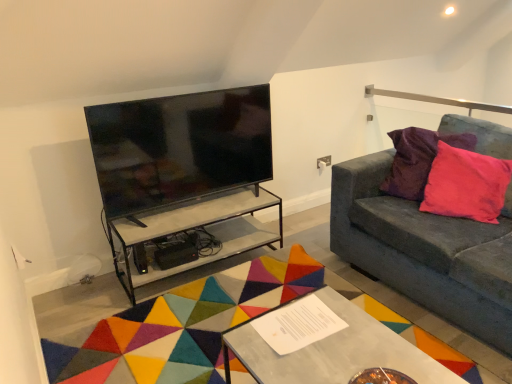
Question: Which direction should I rotate to face clear glass table at center, which appears as the first table when viewed from the back, — up or down?

Choices:
 (A) up
 (B) down

Answer: (B)

Question: In which direction should I rotate to look at metallic silver table at center, which is the first table in front-to-back order?

Choices:
 (A) right
 (B) left

Answer: (A)

Question: Is white paper at center next to clear glass table at center, the 2th table viewed from the front, and touching it?

Choices:
 (A) no
 (B) yes

Answer: (A)

Question: From a real-world perspective, is white paper at center over clear glass table at center, which appears as the first table when viewed from the back?

Choices:
 (A) no
 (B) yes

Answer: (B)

Question: Is clear glass table at center, which appears as the first table when viewed from the back, at the back of white paper at center?

Choices:
 (A) yes
 (B) no

Answer: (B)

Question: Is white paper at center positioned in front of clear glass table at center, the 2th table viewed from the front?

Choices:
 (A) no
 (B) yes

Answer: (B)

Question: Does white paper at center have a greater width compared to clear glass table at center, the 2th table viewed from the front?

Choices:
 (A) yes
 (B) no

Answer: (B)

Question: Would you consider white paper at center to be distant from clear glass table at center, which appears as the first table when viewed from the back?

Choices:
 (A) no
 (B) yes

Answer: (B)

Question: Is metallic silver table at center, the second table viewed from the back, at the right side of multicolored felt mat at center?

Choices:
 (A) yes
 (B) no

Answer: (A)

Question: From a real-world perspective, is metallic silver table at center, the second table viewed from the back, beneath multicolored felt mat at center?

Choices:
 (A) no
 (B) yes

Answer: (A)

Question: Is metallic silver table at center, which is the first table in front-to-back order, at the left side of multicolored felt mat at center?

Choices:
 (A) yes
 (B) no

Answer: (B)

Question: Does metallic silver table at center, which is the first table in front-to-back order, have a smaller size compared to multicolored felt mat at center?

Choices:
 (A) yes
 (B) no

Answer: (A)

Question: Is metallic silver table at center, which is the first table in front-to-back order, aimed at multicolored felt mat at center?

Choices:
 (A) no
 (B) yes

Answer: (A)

Question: Is metallic silver table at center, the second table viewed from the back, outside of multicolored felt mat at center?

Choices:
 (A) no
 (B) yes

Answer: (B)

Question: Can you confirm if pink velvet pillow at right is bigger than black glossy tv at upper left?

Choices:
 (A) no
 (B) yes

Answer: (A)